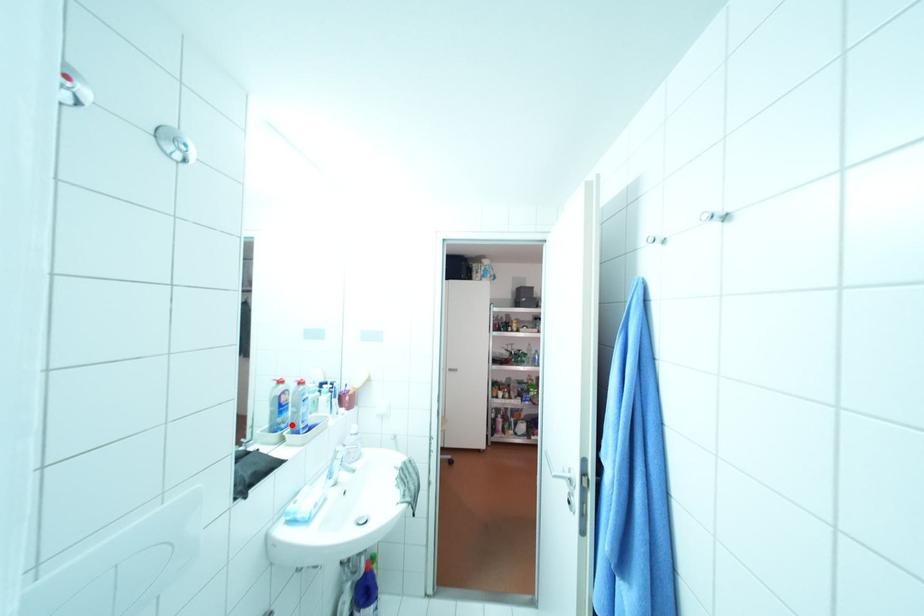
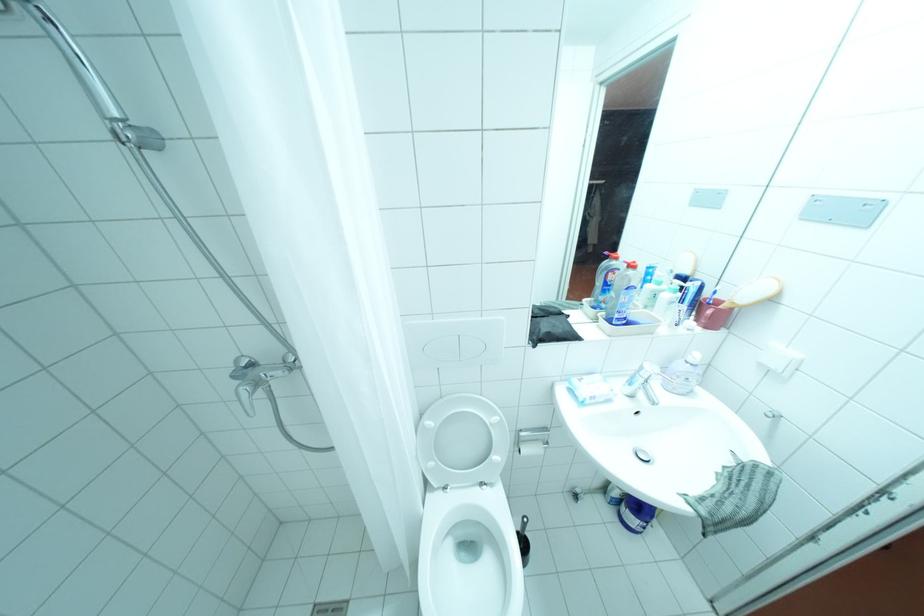
Question: I am providing you with two images of the same scene from different viewpoints. Given a red point in image1, look at the same physical point in image2. Is it:

Choices:
 (A) Closer to the viewpoint
 (B) Farther from the viewpoint

Answer: (A)